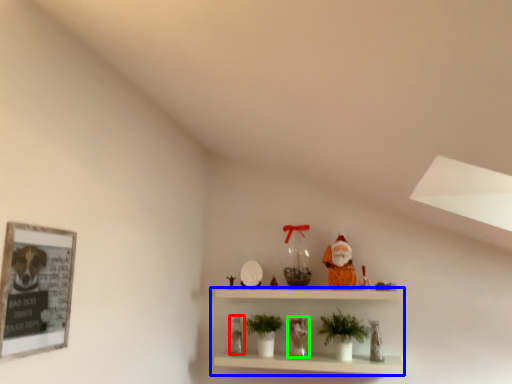
Question: Based on their relative distances, which object is nearer to toy (highlighted by a red box)? Choose from shelf (highlighted by a blue box) and toy (highlighted by a green box).

Choices:
 (A) shelf
 (B) toy

Answer: (B)